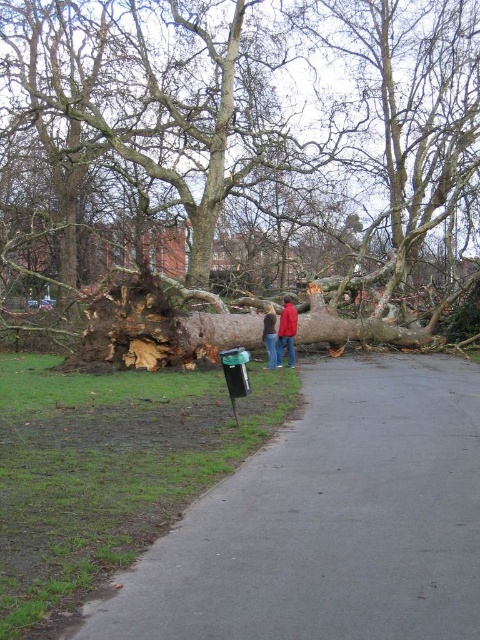
You are a park maintenance worker who needs to clear the pathway blocked by the brown rough bark tree at center. You are currently standing at the red fabric jacket at center. Which direction should you move to reach the tree first?

The brown rough bark tree at center is to the left of the red fabric jacket at center, so you should move to the left to reach the tree first.

You are a park maintenance worker who needs to clear the fallen tree from the pathway. Given the size of the brown rough bark tree at center compared to the red fabric jacket at center, do you think the tree will require a larger vehicle for removal?

The brown rough bark tree at center is larger in size than the red fabric jacket at center, so yes, the tree will require a larger vehicle for removal due to its bigger size.

You are a park maintenance worker who needs to clear the fallen tree trunk from the pathway. You have a tool that can only reach objects within a 0.5 unit radius from your current position at point A. If your current position is at point B, which is at coordinates point B is located at point 0.6, 0.6, can you reach the red fabric jacket at center with your tool?

The red fabric jacket at center is located at point (x=287, y=332). The distance between point B at (x=288, y=384) and the jacket is calculated using the Euclidean distance formula. The difference in the x coordinates is 0.6 minus 0.520 equals 0.08, and the difference in the y coordinates is 0.6 minus 0.598 equals 0.002. Squaring these differences gives 0.0064 and 0.0000004, adding them together results in approximately 0.0064. The square root of 0.0064 is approximately 0.08 units. Since the tool can reach up to 0.